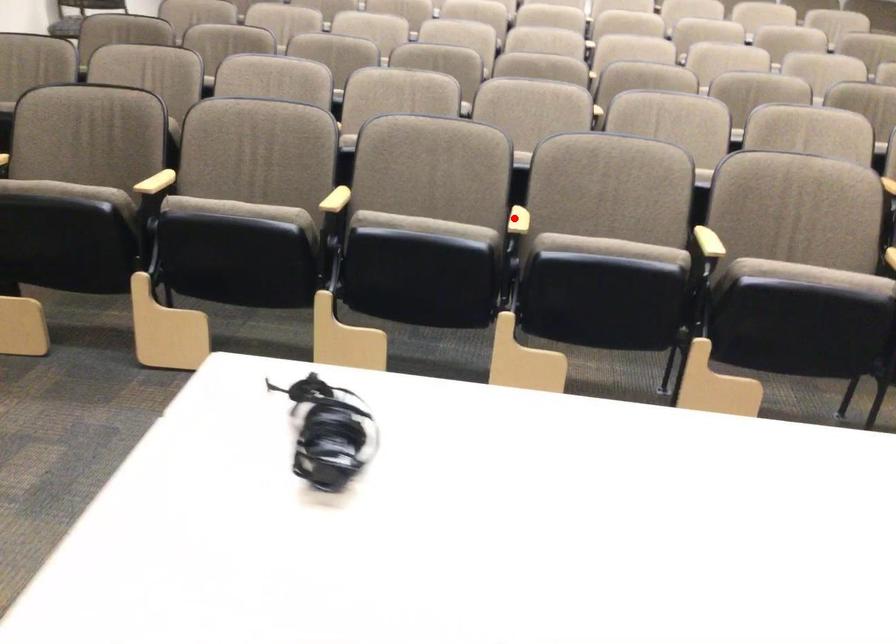
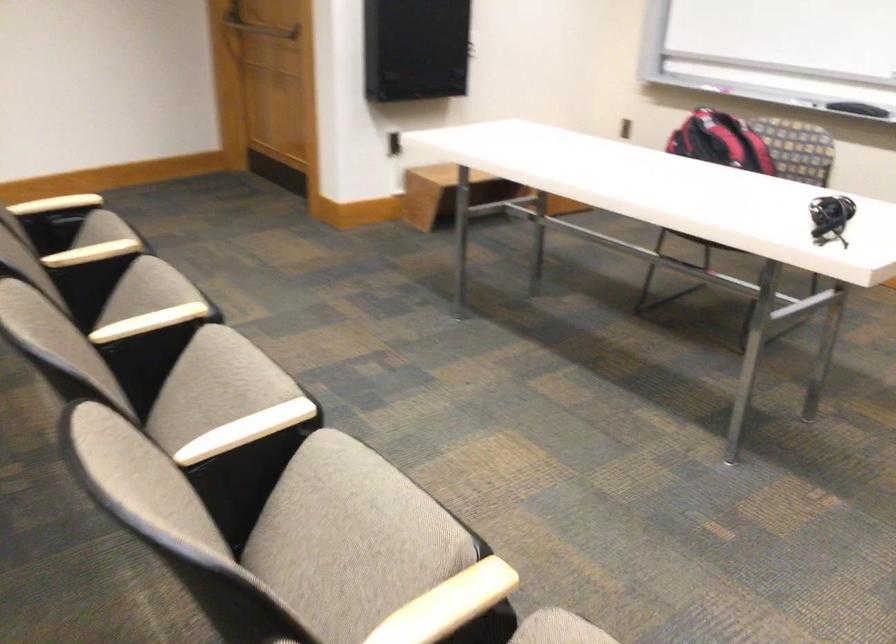
Question: I am providing you with two images of the same scene from different viewpoints. Given a red point in image1, look at the same physical point in image2. Is it:

Choices:
 (A) Closer to the viewpoint
 (B) Farther from the viewpoint

Answer: (A)